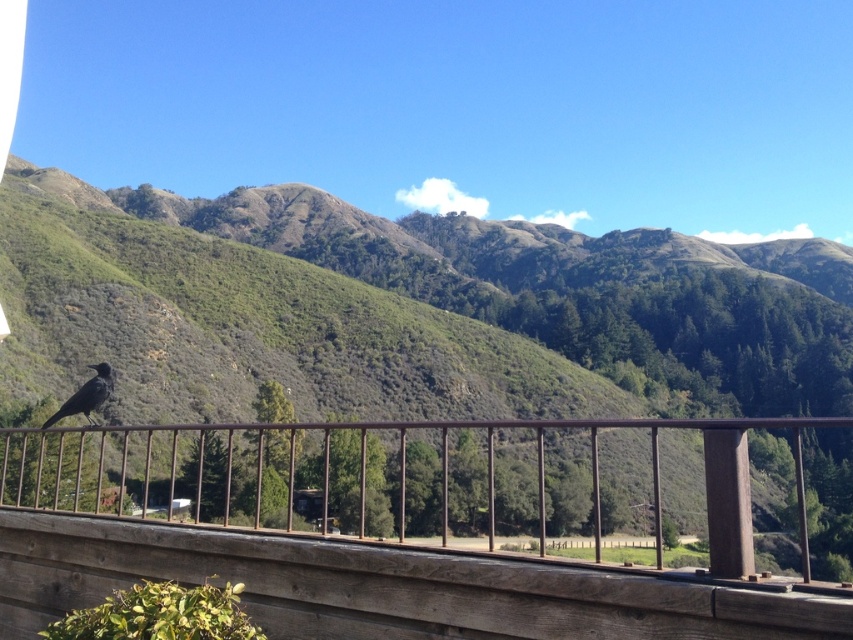
You are standing on the balcony and notice both the brown wooden balcony at lower left and the shiny black bird at lower left. Which object is closer to you?

The brown wooden balcony at lower left is closer to you because it is in front of the shiny black bird at lower left.

You are standing on the brown wooden balcony at lower left and want to take a photo of the green textured hillside at center. Can you see the entire hillside from your current position?

The green textured hillside at center is taller than the brown wooden balcony at lower left, so you cannot see the entire hillside from your current position because the balcony is shorter and might block the view of the top part of the hillside.